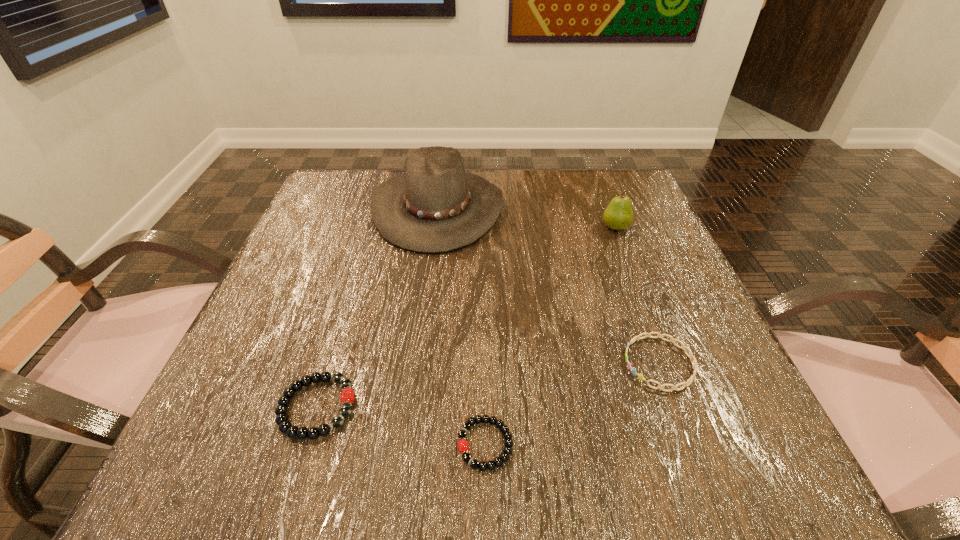
This screenshot has width=960, height=540. Identify the location of hat. (436, 207).

At what (x,y) coordinates should I click in order to perform the action: click on the second tallest object. Please return your answer as a coordinate pair (x, y). The height and width of the screenshot is (540, 960). Looking at the image, I should click on pos(618,215).

This screenshot has width=960, height=540. Identify the location of the third tallest object. (285, 426).

Identify the location of the leftmost bracelet. The height and width of the screenshot is (540, 960). (285, 426).

Locate an element on the screen. This screenshot has width=960, height=540. the rightmost bracelet is located at coordinates (694, 364).

Image resolution: width=960 pixels, height=540 pixels. Identify the location of the second bracelet from right to left. (463, 446).

The width and height of the screenshot is (960, 540). I want to click on the shortest object, so click(463, 446).

Image resolution: width=960 pixels, height=540 pixels. In order to click on free space located 0.140m on the front-facing side of the hat in this screenshot , I will do `click(563, 208)`.

Where is `vacant point located 0.300m on the front of the pear`? The image size is (960, 540). vacant point located 0.300m on the front of the pear is located at coordinates (660, 343).

This screenshot has height=540, width=960. I want to click on free space located on the back of the third tallest object, so click(358, 274).